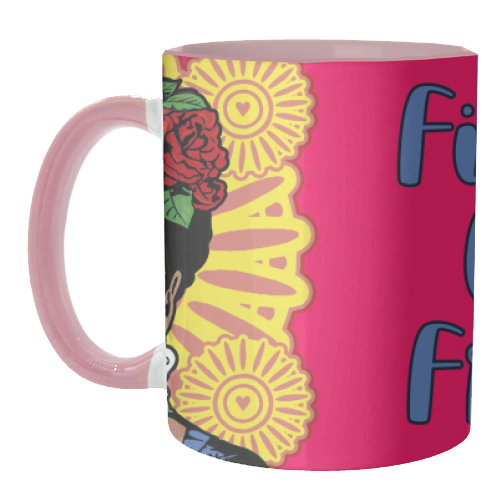
This screenshot has height=500, width=500. What are the coordinates of `slight view of inside of cup` in the screenshot? It's located at (300, 53).